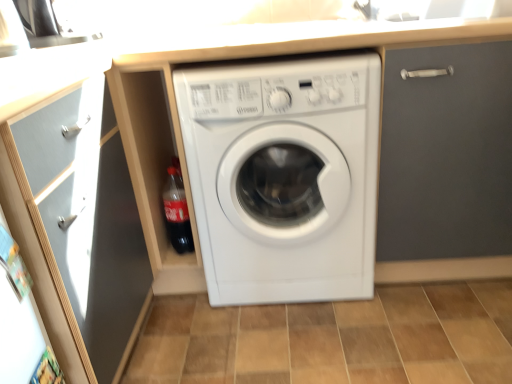
Question: Considering the relative positions of brown tile at center and transparent glass door at left in the image provided, is brown tile at center to the left of transparent glass door at left from the viewer's perspective?

Choices:
 (A) no
 (B) yes

Answer: (A)

Question: From the image's perspective, is brown tile at center beneath transparent glass door at left?

Choices:
 (A) yes
 (B) no

Answer: (A)

Question: Is transparent glass door at left at the back of brown tile at center?

Choices:
 (A) no
 (B) yes

Answer: (A)

Question: Is brown tile at center taller than transparent glass door at left?

Choices:
 (A) yes
 (B) no

Answer: (B)

Question: Can we say brown tile at center lies outside transparent glass door at left?

Choices:
 (A) yes
 (B) no

Answer: (A)

Question: Does brown tile at center have a lesser height compared to transparent glass door at left?

Choices:
 (A) yes
 (B) no

Answer: (A)

Question: Is translucent plastic bottle at lower left at the right side of transparent glass door at left?

Choices:
 (A) no
 (B) yes

Answer: (B)

Question: From a real-world perspective, is translucent plastic bottle at lower left over transparent glass door at left?

Choices:
 (A) yes
 (B) no

Answer: (B)

Question: From the image's perspective, is translucent plastic bottle at lower left beneath transparent glass door at left?

Choices:
 (A) no
 (B) yes

Answer: (A)

Question: Does translucent plastic bottle at lower left have a larger size compared to transparent glass door at left?

Choices:
 (A) yes
 (B) no

Answer: (B)

Question: Does translucent plastic bottle at lower left have a greater height compared to transparent glass door at left?

Choices:
 (A) yes
 (B) no

Answer: (B)

Question: Does translucent plastic bottle at lower left have a smaller size compared to transparent glass door at left?

Choices:
 (A) yes
 (B) no

Answer: (A)

Question: Does translucent plastic bottle at lower left touch matte gray door at upper right?

Choices:
 (A) yes
 (B) no

Answer: (B)